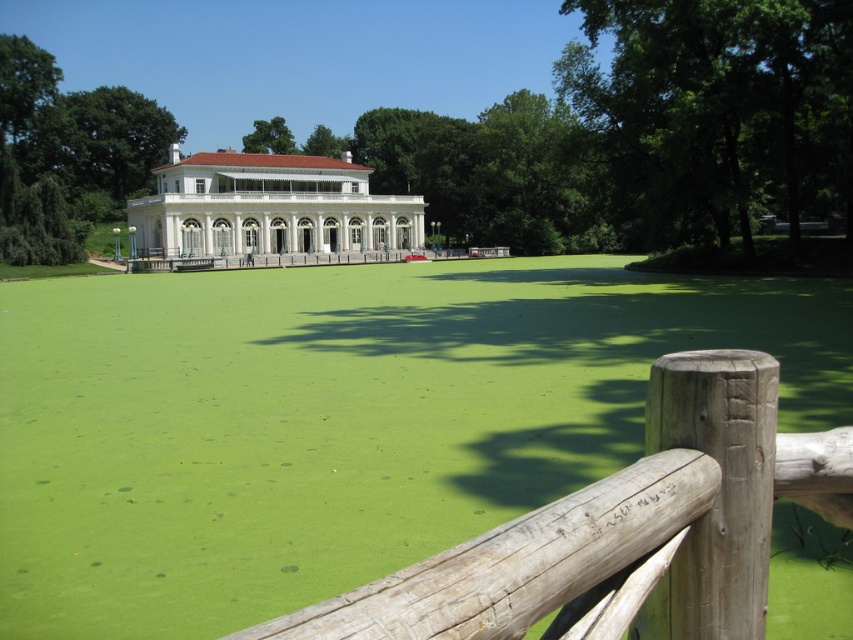
You are standing in the park and want to take a photo of the two points marked in the image. Which point, point (393, 625) or point (357, 260), is closer to you?

Point (393, 625) is closer to the camera than point (357, 260), so it is closer to you.

You are a painter who wants to capture the scene of the weathered wood fence at lower center and the wooden at center in your painting. Which object should you draw first if you want to follow the rule of drawing background elements before foreground elements?

The wooden at center is closer to you than the weathered wood fence at lower center, so you should draw the weathered wood fence at lower center first as it is in the background.